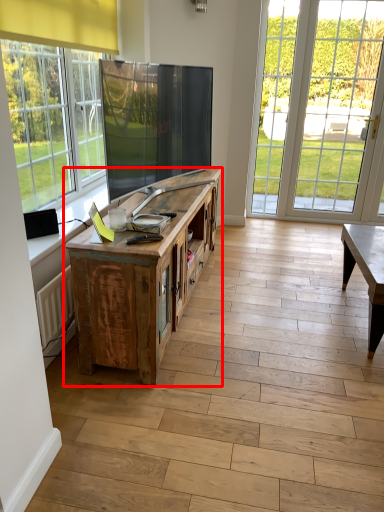
Question: Where is cabinetry (annotated by the red box) located in relation to glass door in the image?

Choices:
 (A) right
 (B) left

Answer: (B)